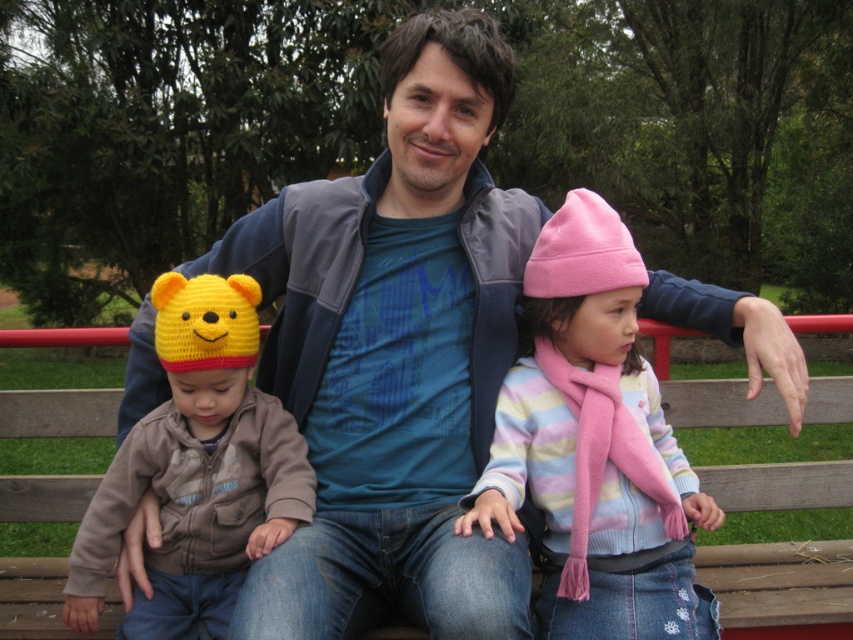
Looking at this image, you are a photographer trying to capture a group photo of the three individuals on the wooden bench. The pink fleece hat at center and the knitted yellow hat at left are important for the composition. Can you position your camera so that both hats are within the frame without any overlap? Explain your reasoning.

The pink fleece hat at center and the knitted yellow hat at left are 26.80 inches apart. Since 26.80 inches is a significant distance, positioning the camera appropriately would allow both hats to be captured within the frame without overlapping. Ensure the camera angle includes both the center and left positions on the bench.

You are a photographer standing at a distance of 6 feet from the camera. You want to take a closeup shot of the pink fleece hat at center. Can you reach it with your hand without moving from your current position?

The pink fleece hat at center is 5.55 feet away from the camera. Since you are standing 6 feet away from the camera, you are farther than the hat. You cannot reach it without moving closer.

You are a photographer taking a group photo of the three people on the wooden bench. You notice two hats nearby. The pink fleece hat at center and the knitted yellow hat at left. Which hat is positioned more to the left side?

The knitted yellow hat at left is positioned more to the left side because the pink fleece hat at center is to the right of it.